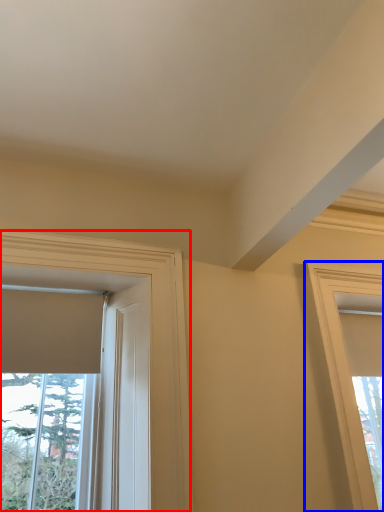
Question: Which object is further to the camera taking this photo, window (highlighted by a red box) or window (highlighted by a blue box)?

Choices:
 (A) window
 (B) window

Answer: (B)